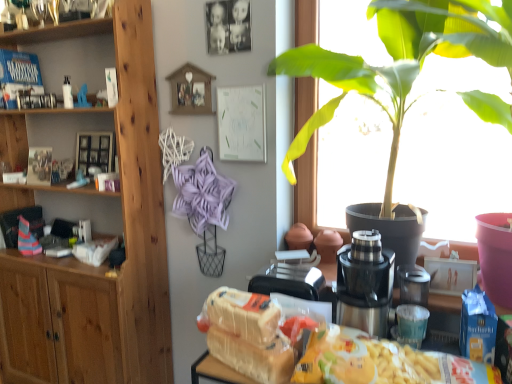
Question: Is satin silver blender at center to the right of matte blue toy at left from the viewer's perspective?

Choices:
 (A) no
 (B) yes

Answer: (B)

Question: Considering the relative positions of satin silver blender at center and matte blue toy at left in the image provided, is satin silver blender at center behind matte blue toy at left?

Choices:
 (A) no
 (B) yes

Answer: (A)

Question: From the image's perspective, is satin silver blender at center beneath matte blue toy at left?

Choices:
 (A) no
 (B) yes

Answer: (B)

Question: Does satin silver blender at center have a greater height compared to matte blue toy at left?

Choices:
 (A) no
 (B) yes

Answer: (B)

Question: Would you say matte blue toy at left is part of satin silver blender at center's contents?

Choices:
 (A) no
 (B) yes

Answer: (A)

Question: In terms of height, does green leafy plant at upper right look taller or shorter compared to satin silver blender at center?

Choices:
 (A) tall
 (B) short

Answer: (A)

Question: Would you say green leafy plant at upper right is to the left or to the right of satin silver blender at center in the picture?

Choices:
 (A) right
 (B) left

Answer: (A)

Question: Relative to satin silver blender at center, is green leafy plant at upper right in front or behind?

Choices:
 (A) front
 (B) behind

Answer: (A)

Question: Would you say green leafy plant at upper right is inside or outside satin silver blender at center?

Choices:
 (A) inside
 (B) outside

Answer: (B)

Question: From the image's perspective, is translucent plastic bag at lower center positioned above or below white bread at center?

Choices:
 (A) below
 (B) above

Answer: (A)

Question: Would you say translucent plastic bag at lower center is to the left or to the right of white bread at center in the picture?

Choices:
 (A) left
 (B) right

Answer: (B)

Question: Is point (358, 336) closer or farther from the camera than point (244, 314)?

Choices:
 (A) farther
 (B) closer

Answer: (B)

Question: From a real-world perspective, is translucent plastic bag at lower center physically located above or below white bread at center?

Choices:
 (A) below
 (B) above

Answer: (B)

Question: Choose the correct answer: Is translucent plastic bag at lower center inside satin silver blender at center or outside it?

Choices:
 (A) inside
 (B) outside

Answer: (B)

Question: Based on their positions, is translucent plastic bag at lower center located to the left or right of satin silver blender at center?

Choices:
 (A) left
 (B) right

Answer: (A)